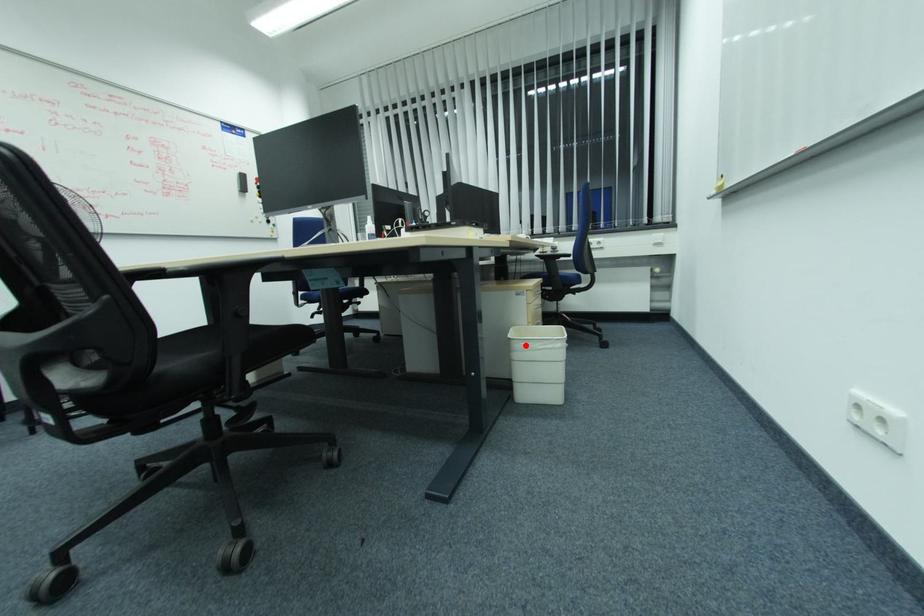
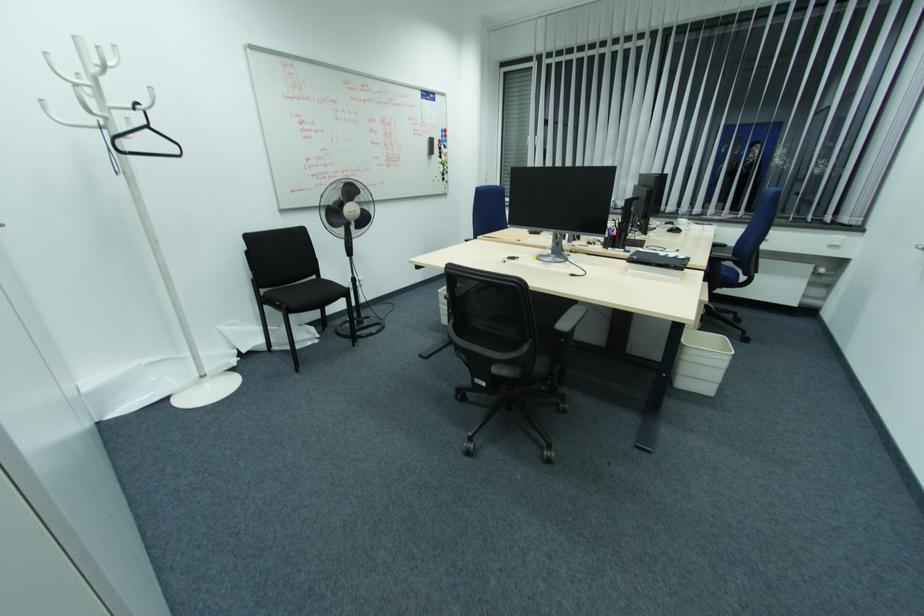
In the second image, find the point that corresponds to the highlighted location in the first image.

(698, 353)